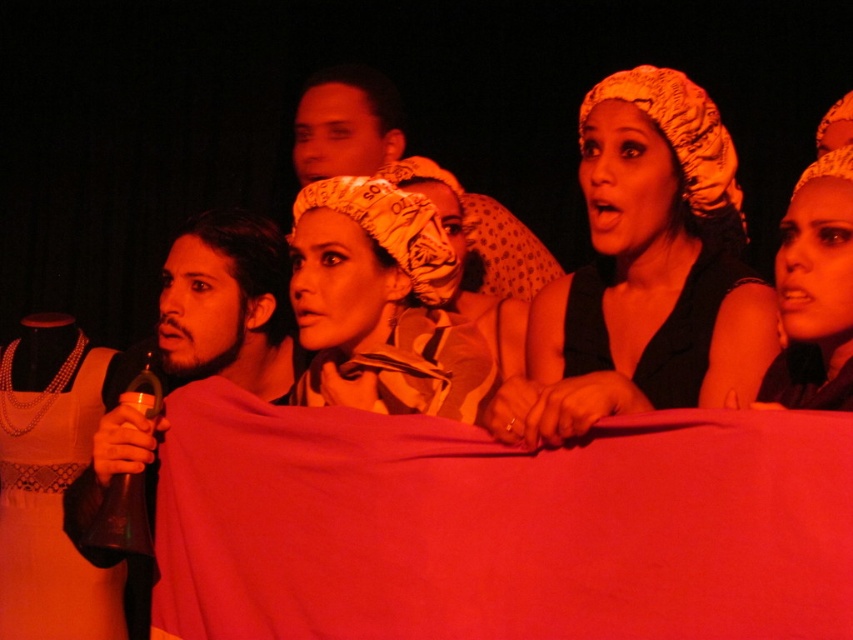
Question: Does matte yellow headscarf at upper right appear under matte beige headscarf at upper right?

Choices:
 (A) no
 (B) yes

Answer: (B)

Question: Does silky red fabric at center have a greater width compared to white lace dress at left?

Choices:
 (A) yes
 (B) no

Answer: (A)

Question: Is matte yellow headscarf at upper right to the left of matte beige headscarf at upper right from the viewer's perspective?

Choices:
 (A) no
 (B) yes

Answer: (B)

Question: Which of the following is the farthest from the observer?

Choices:
 (A) (231, 570)
 (B) (82, 458)

Answer: (B)

Question: Which point is closer to the camera?

Choices:
 (A) silky red fabric at center
 (B) matte beige headscarf at upper right
 (C) white lace dress at left

Answer: (A)

Question: Which point is farther from the camera taking this photo?

Choices:
 (A) (83, 627)
 (B) (410, 580)

Answer: (A)